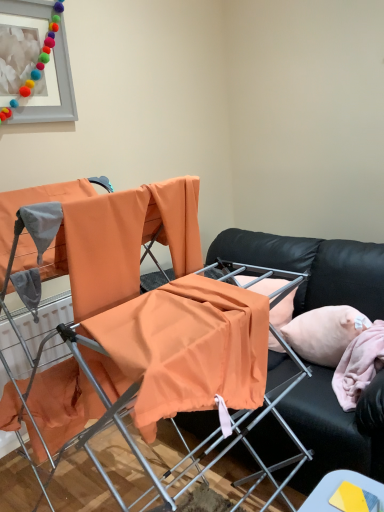
Question: Is pink fabric pillow at right at the back of black leather couch at center?

Choices:
 (A) yes
 (B) no

Answer: (A)

Question: Is black leather couch at center surrounding pink fabric pillow at right?

Choices:
 (A) yes
 (B) no

Answer: (A)

Question: Does black leather couch at center have a lesser width compared to pink fabric pillow at right?

Choices:
 (A) no
 (B) yes

Answer: (A)

Question: From a real-world perspective, is black leather couch at center under pink fabric pillow at right?

Choices:
 (A) yes
 (B) no

Answer: (A)

Question: Is black leather couch at center positioned far away from pink fabric pillow at right?

Choices:
 (A) no
 (B) yes

Answer: (A)

Question: Does black leather couch at center have a larger size compared to pink fabric pillow at right?

Choices:
 (A) no
 (B) yes

Answer: (B)

Question: Can you confirm if orange fabric chair at center is shorter than smooth yellow card at lower right?

Choices:
 (A) no
 (B) yes

Answer: (A)

Question: Is orange fabric chair at center smaller than smooth yellow card at lower right?

Choices:
 (A) no
 (B) yes

Answer: (A)

Question: Is orange fabric chair at center closer to the viewer compared to smooth yellow card at lower right?

Choices:
 (A) yes
 (B) no

Answer: (A)

Question: Is orange fabric chair at center at the right side of smooth yellow card at lower right?

Choices:
 (A) no
 (B) yes

Answer: (A)

Question: Is orange fabric chair at center touching smooth yellow card at lower right?

Choices:
 (A) no
 (B) yes

Answer: (A)

Question: Does orange fabric chair at center have a greater height compared to smooth yellow card at lower right?

Choices:
 (A) yes
 (B) no

Answer: (A)

Question: Would you say smooth yellow card at lower right contains matte gray picture frame at upper left?

Choices:
 (A) no
 (B) yes

Answer: (A)